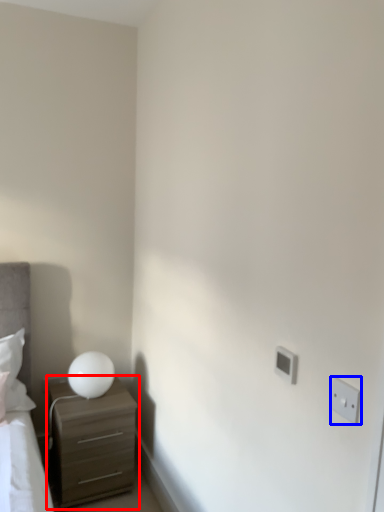
Question: Which object is further to the camera taking this photo, chest of drawers (highlighted by a red box) or electric outlet (highlighted by a blue box)?

Choices:
 (A) chest of drawers
 (B) electric outlet

Answer: (A)